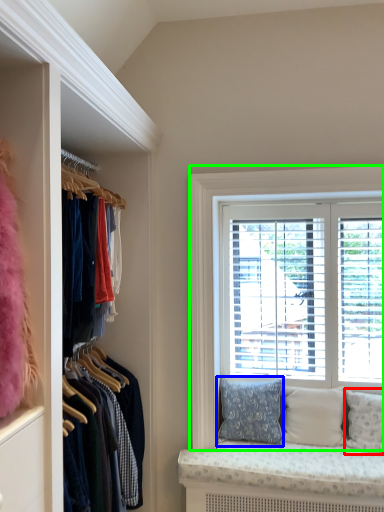
Question: Considering the real-world distances, which object is closest to pillow (highlighted by a red box)? pillow (highlighted by a blue box) or window (highlighted by a green box).

Choices:
 (A) pillow
 (B) window

Answer: (A)